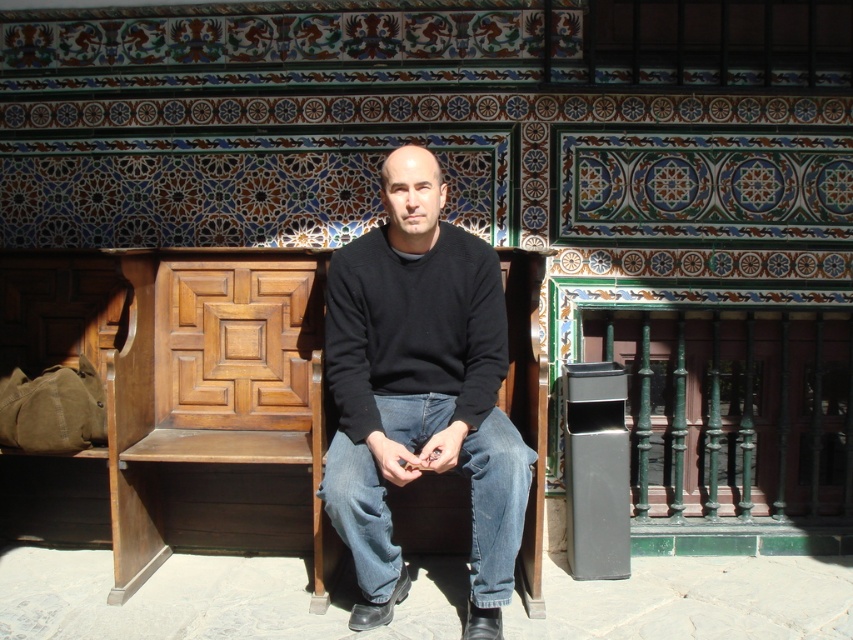
You are standing in the outdoor setting shown in the image. There is a point at coordinates (413,326). Which object is this point located on?

The point at coordinates (413,326) is located on the black knitted sweater at center.

You are a tailor who needs to determine which item of clothing is bigger between the black sweater at center and the denim at center. Which one should you choose for a customer who prefers larger garments?

The black sweater at center is larger in size than the denim at center, so you should choose the black sweater at center for the customer who prefers larger garments.